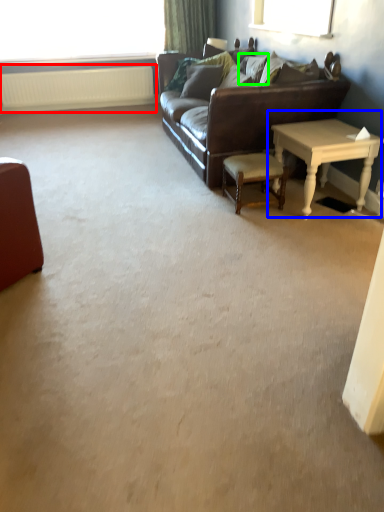
Question: Which object is the closest to the radiator (highlighted by a red box)? Choose among these: table (highlighted by a blue box) or pillow (highlighted by a green box).

Choices:
 (A) table
 (B) pillow

Answer: (B)